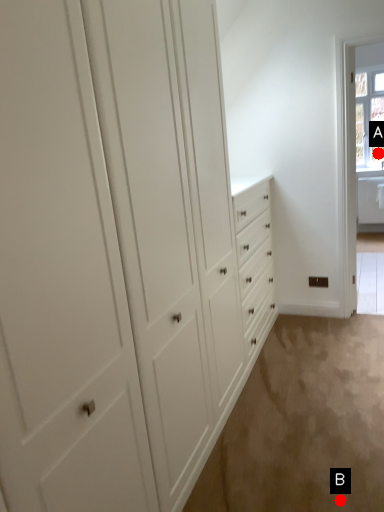
Question: Two points are circled on the image, labeled by A and B beside each circle. Which point is closer to the camera?

Choices:
 (A) A is closer
 (B) B is closer

Answer: (B)